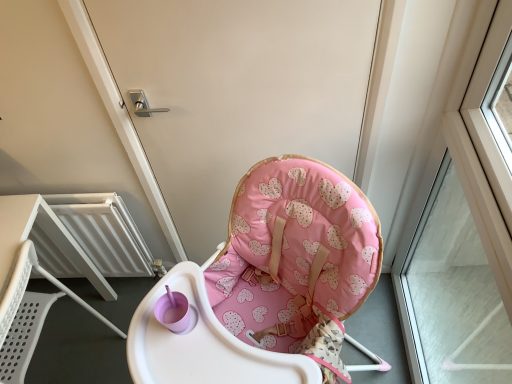
Question: Based on their positions, is pink fabric highchair at center located to the left or right of transparent glass window at right?

Choices:
 (A) right
 (B) left

Answer: (B)

Question: In terms of width, does pink fabric highchair at center look wider or thinner when compared to transparent glass window at right?

Choices:
 (A) thin
 (B) wide

Answer: (A)

Question: Which of these objects is positioned farthest from the white plastic chair at lower left?

Choices:
 (A) white metallic radiator at left
 (B) transparent glass window at right
 (C) pink fabric highchair at center

Answer: (B)

Question: Considering the real-world distances, which object is farthest from the white metallic radiator at left?

Choices:
 (A) white plastic chair at lower left
 (B) transparent glass window at right
 (C) pink fabric highchair at center

Answer: (B)